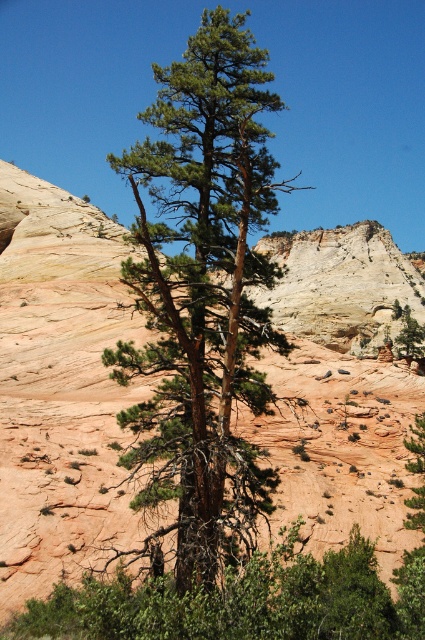
Question: Which object appears farthest from the camera in this image?

Choices:
 (A) matte brown rock at center
 (B) green needle-like tree at center

Answer: (A)

Question: From the image, what is the correct spatial relationship of matte brown rock at center in relation to green needle-like tree at center?

Choices:
 (A) below
 (B) above

Answer: (A)

Question: Can you confirm if matte brown rock at center is wider than green needle-like tree at center?

Choices:
 (A) yes
 (B) no

Answer: (A)

Question: Is matte brown rock at center wider than green needle-like tree at center?

Choices:
 (A) no
 (B) yes

Answer: (B)

Question: Which object appears closest to the camera in this image?

Choices:
 (A) green needle-like tree at center
 (B) matte brown rock at center

Answer: (A)